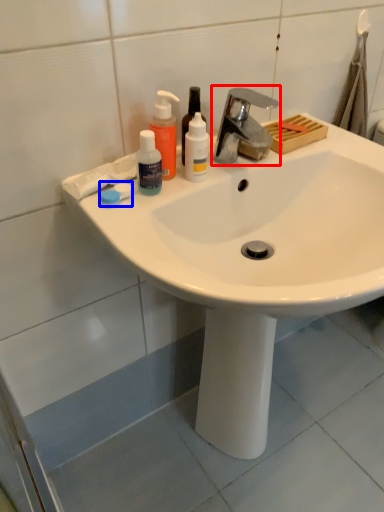
Question: Among these objects, which one is farthest to the camera, tap (highlighted by a red box) or soap (highlighted by a blue box)?

Choices:
 (A) tap
 (B) soap

Answer: (B)